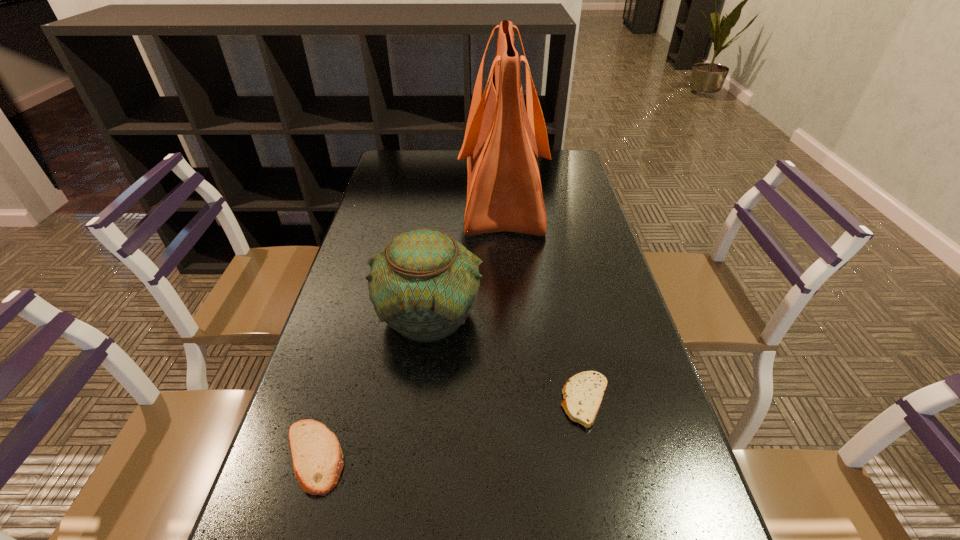
Find the location of a particular element. This screenshot has height=540, width=960. free space located 0.200m on the front pocket of the farthest object is located at coordinates (401, 195).

Where is `vacant region located on the front of the third shortest object`? This screenshot has width=960, height=540. vacant region located on the front of the third shortest object is located at coordinates coord(417,423).

Where is `vacant space located 0.150m on the right of the second shortest object`? This screenshot has height=540, width=960. vacant space located 0.150m on the right of the second shortest object is located at coordinates (429, 457).

The height and width of the screenshot is (540, 960). I want to click on vacant space located 0.150m on the left of the shorter pita bread, so click(x=486, y=401).

Locate an element on the screen. This screenshot has width=960, height=540. object at the far edge is located at coordinates (502, 141).

This screenshot has height=540, width=960. What are the coordinates of `pottery at the left edge` in the screenshot? It's located at (424, 284).

The height and width of the screenshot is (540, 960). What are the coordinates of `pita bread located in the left edge section of the desktop` in the screenshot? It's located at (317, 458).

The width and height of the screenshot is (960, 540). What are the coordinates of `shopping bag that is at the right edge` in the screenshot? It's located at (502, 141).

You are a GUI agent. You are given a task and a screenshot of the screen. Output one action in this format:
    pyautogui.click(x=<x>, y=<y>)
    Task: Click on the pita bread present at the right edge
    This screenshot has height=540, width=960.
    Given the screenshot: What is the action you would take?
    pyautogui.click(x=583, y=393)

The height and width of the screenshot is (540, 960). I want to click on object present at the far right corner, so click(x=502, y=141).